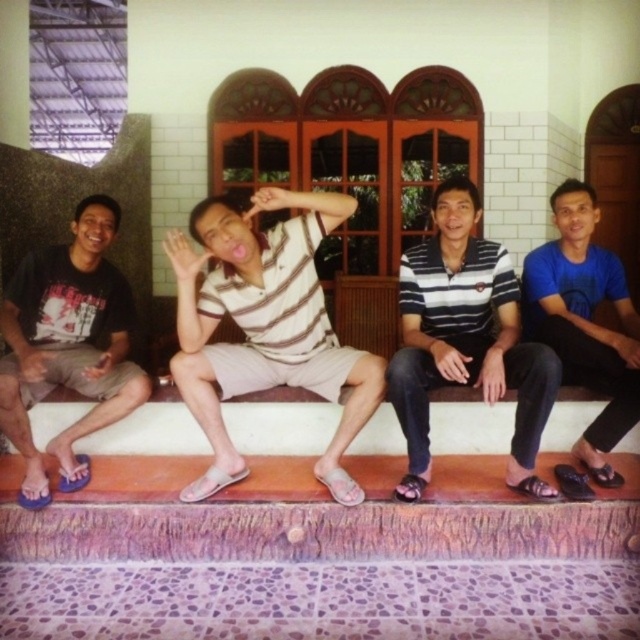
Consider the image. You are a photographer trying to capture a group photo of the striped polo shirt at center and the blue fabric shirt at right. Since you want to ensure both are visible, which side should you position yourself relative to the group?

You should position yourself to the right of the group so that both the striped polo shirt at center and the blue fabric shirt at right are fully visible, as the striped polo shirt at center is on the left side of the blue fabric shirt at right.

You are a photographer trying to capture a candid shot of the striped polo shirt at center and the matte black shirt at left. Since you want to focus on their faces, which one should you aim your camera at first to ensure their face is in the frame?

The striped polo shirt at center is above the matte black shirt at left, so aiming at the striped polo shirt at center first will ensure their face is in the frame since it is positioned higher.

You are standing in front of the building with three arched windows. You notice two points marked on the wall. Which point, point (403, 385) or point (620, 372), is closer to you?

Point (403, 385) is closer to the viewer than point (620, 372).